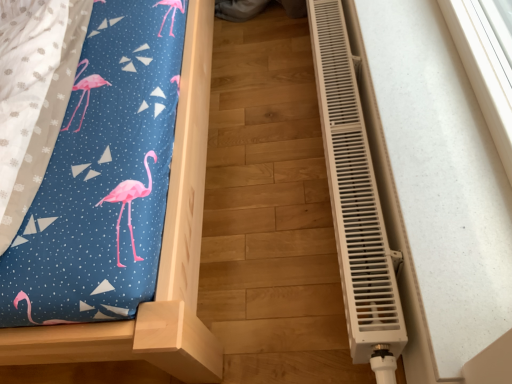
Question: Is wooden bed frame at left directly adjacent to white plastic radiator at right?

Choices:
 (A) no
 (B) yes

Answer: (A)

Question: Is wooden bed frame at left aimed at white plastic radiator at right?

Choices:
 (A) no
 (B) yes

Answer: (A)

Question: Considering the relative sizes of wooden bed frame at left and white plastic radiator at right in the image provided, is wooden bed frame at left thinner than white plastic radiator at right?

Choices:
 (A) no
 (B) yes

Answer: (A)

Question: Could white plastic radiator at right be considered to be inside wooden bed frame at left?

Choices:
 (A) yes
 (B) no

Answer: (B)

Question: Considering the relative sizes of wooden bed frame at left and white plastic radiator at right in the image provided, is wooden bed frame at left bigger than white plastic radiator at right?

Choices:
 (A) yes
 (B) no

Answer: (A)

Question: Is wooden bed frame at left to the right of white plastic radiator at right from the viewer's perspective?

Choices:
 (A) no
 (B) yes

Answer: (A)

Question: Does white plastic radiator at right have a smaller size compared to wooden bed frame at left?

Choices:
 (A) yes
 (B) no

Answer: (A)

Question: Is white plastic radiator at right to the right of wooden bed frame at left from the viewer's perspective?

Choices:
 (A) no
 (B) yes

Answer: (B)

Question: Is white plastic radiator at right at the left side of wooden bed frame at left?

Choices:
 (A) no
 (B) yes

Answer: (A)

Question: From the image's perspective, is white plastic radiator at right on top of wooden bed frame at left?

Choices:
 (A) no
 (B) yes

Answer: (A)

Question: Is white plastic radiator at right not near wooden bed frame at left?

Choices:
 (A) no
 (B) yes

Answer: (A)

Question: Can you confirm if white plastic radiator at right is bigger than wooden bed frame at left?

Choices:
 (A) yes
 (B) no

Answer: (B)

Question: Based on their positions, is wooden bed frame at left located to the left or right of white plastic radiator at right?

Choices:
 (A) left
 (B) right

Answer: (A)